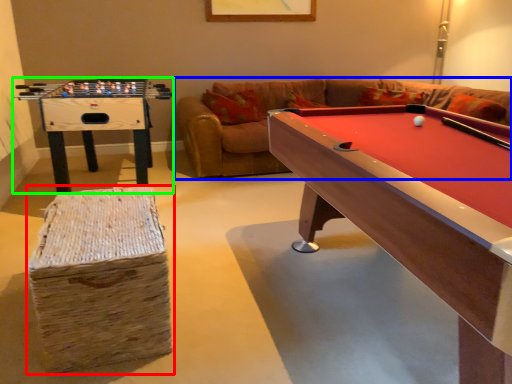
Question: Estimate the real-world distances between objects in this image. Which object is farther from bar stool (highlighted by a red box), couch (highlighted by a blue box) or table (highlighted by a green box)?

Choices:
 (A) couch
 (B) table

Answer: (A)